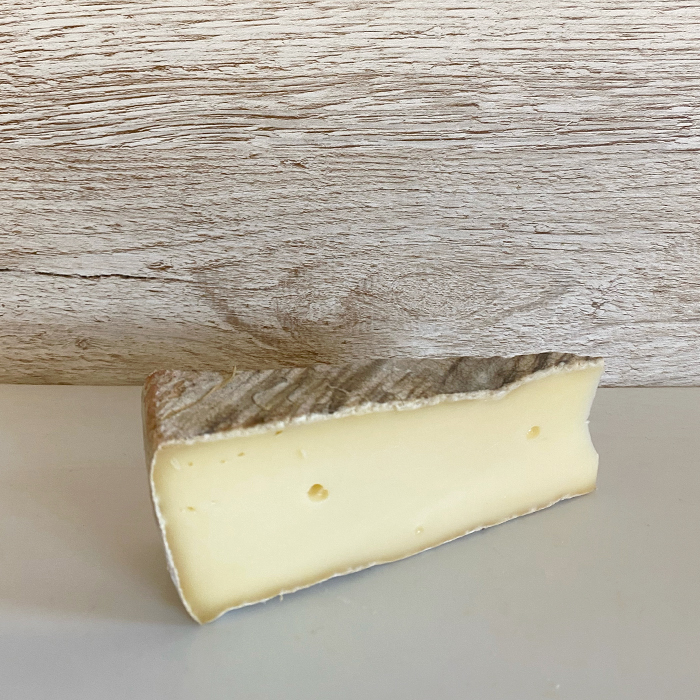
This screenshot has height=700, width=700. In order to click on wood finish in this screenshot , I will do `click(238, 384)`.